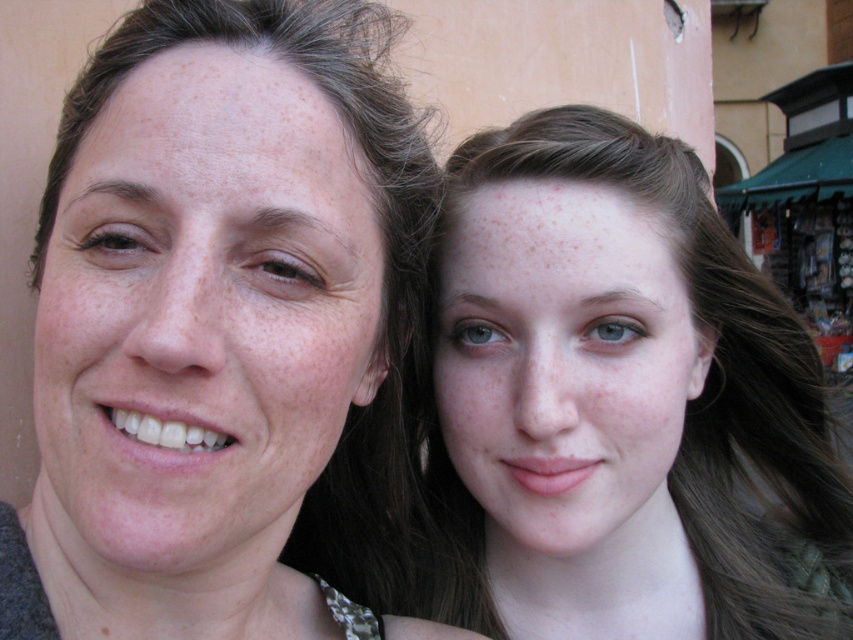
Looking at this image, you are a photographer trying to capture both the matte skin at center and the smooth skin face at upper right in a single frame. Based on their sizes, which one should you focus on to ensure both fit comfortably in the photo?

The matte skin at center is narrower than the smooth skin face at upper right, so focusing on the larger smooth skin face at upper right would allow both to fit comfortably in the photo.

You are a photographer capturing a portrait of two people. You need to ensure both subjects are in focus. The matte skin at center and smooth skin face at upper right are part of the scene. Which subject should you adjust your camera focus on first to ensure both are sharp?

The matte skin at center is to the left of smooth skin face at upper right. Since they are positioned close to each other horizontally, adjusting focus on either subject should keep both in sharp focus as their proximity allows for a single focal plane.